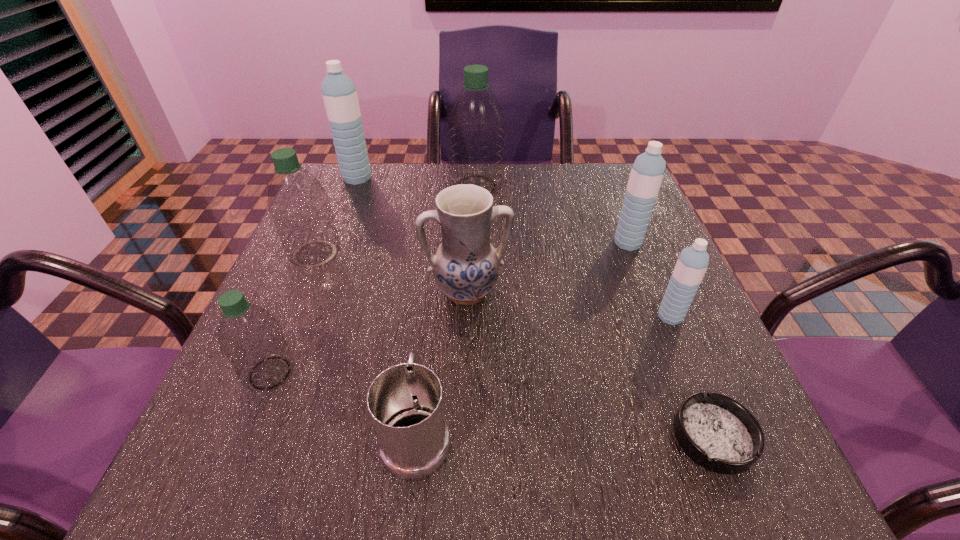
Identify the location of the fourth water bottle from left to right. (476, 130).

The width and height of the screenshot is (960, 540). Find the location of `the rightmost green water bottle`. the rightmost green water bottle is located at coordinates (476, 130).

What are the coordinates of `the leftmost blue water bottle` in the screenshot? It's located at (339, 94).

What are the coordinates of `the biggest blue water bottle` in the screenshot? It's located at pyautogui.click(x=339, y=94).

Where is `the second farthest green water bottle`? The image size is (960, 540). the second farthest green water bottle is located at coordinates (298, 204).

Find the location of `the second nearest blue water bottle`. the second nearest blue water bottle is located at coordinates (647, 172).

You are a GUI agent. You are given a task and a screenshot of the screen. Output one action in this format:
    pyautogui.click(x=<x>, y=<y>)
    Task: Click on the blue pottery
    The image size is (960, 540).
    Given the screenshot: What is the action you would take?
    pyautogui.click(x=465, y=267)

Identify the location of the second nearest water bottle. (692, 263).

Locate an element on the screen. the nearest blue water bottle is located at coordinates (692, 263).

Image resolution: width=960 pixels, height=540 pixels. I want to click on the smallest green water bottle, so click(x=250, y=338).